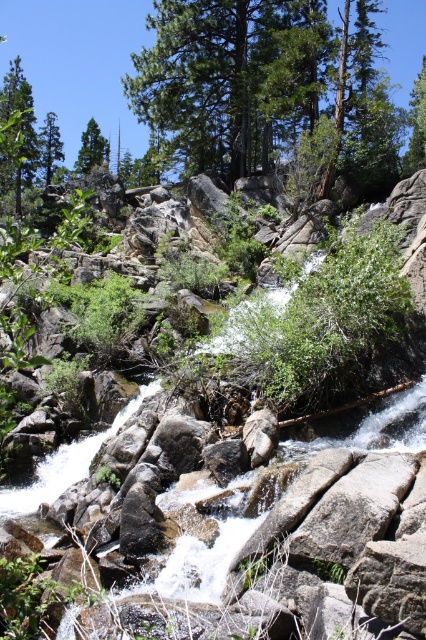
Question: Does green matte tree at upper center have a larger size compared to green matte tree at upper left?

Choices:
 (A) yes
 (B) no

Answer: (B)

Question: Does green leafy tree at left appear on the left side of green matte tree at upper left?

Choices:
 (A) yes
 (B) no

Answer: (B)

Question: Is green textured tree at upper center bigger than green matte tree at upper center?

Choices:
 (A) no
 (B) yes

Answer: (A)

Question: Which of the following is the farthest from the observer?

Choices:
 (A) green matte tree at upper center
 (B) green matte tree at upper left
 (C) green textured tree at upper center

Answer: (B)

Question: Considering the real-world distances, which object is farthest from the green matte tree at upper center?

Choices:
 (A) green textured tree at upper center
 (B) green leafy tree at left
 (C) green matte tree at upper right
 (D) green matte tree at upper left

Answer: (C)

Question: Which of the following is the closest to the observer?

Choices:
 (A) (423, 125)
 (B) (103, 150)

Answer: (A)